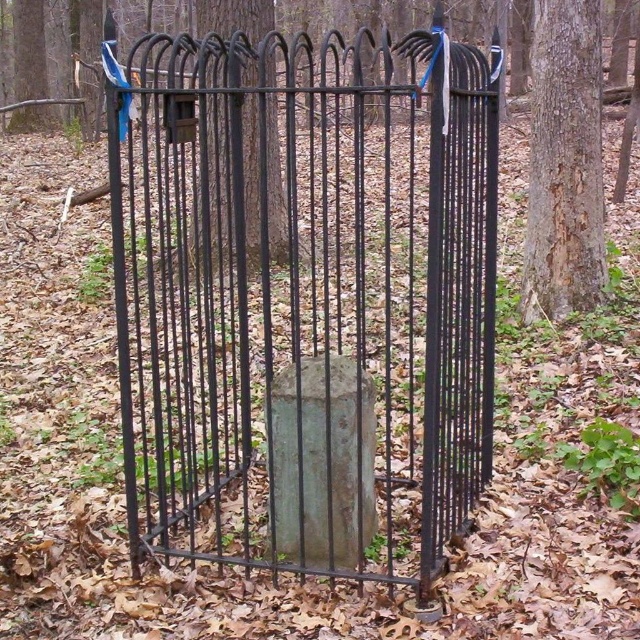
Question: Which of the following is the farthest from the observer?

Choices:
 (A) smooth brown bark at right
 (B) black metal fence at center

Answer: (A)

Question: Does matte black gate at center have a larger size compared to black metal fence at center?

Choices:
 (A) yes
 (B) no

Answer: (A)

Question: Can you confirm if black wrought iron gate at center is wider than smooth brown bark at right?

Choices:
 (A) yes
 (B) no

Answer: (B)

Question: Which object appears farthest from the camera in this image?

Choices:
 (A) smooth brown bark at right
 (B) matte black gate at center
 (C) black wrought iron gate at center

Answer: (B)

Question: Is the position of black wrought iron gate at center less distant than that of smooth brown bark at right?

Choices:
 (A) yes
 (B) no

Answer: (A)

Question: Which point is farther from the camera taking this photo?

Choices:
 (A) (541, 61)
 (B) (38, 122)

Answer: (B)